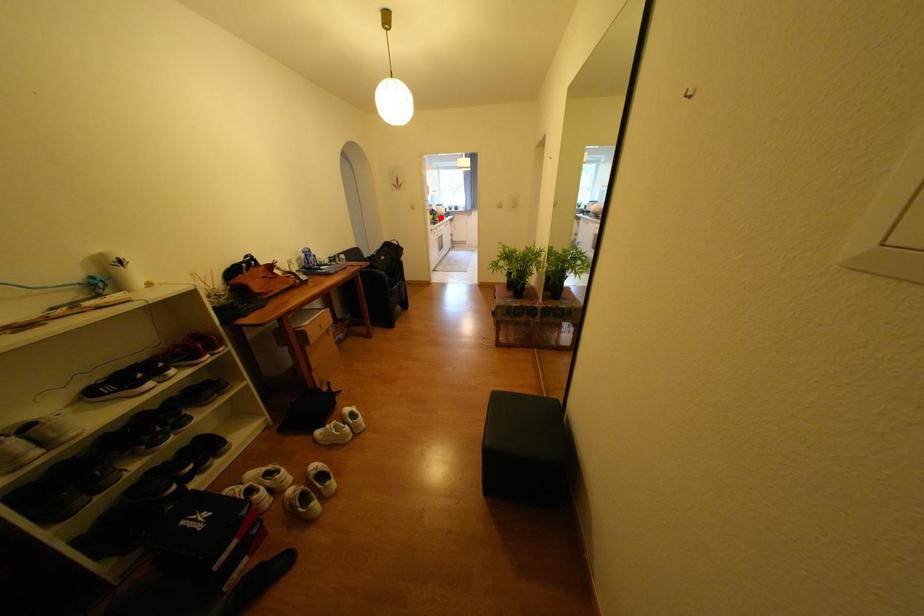
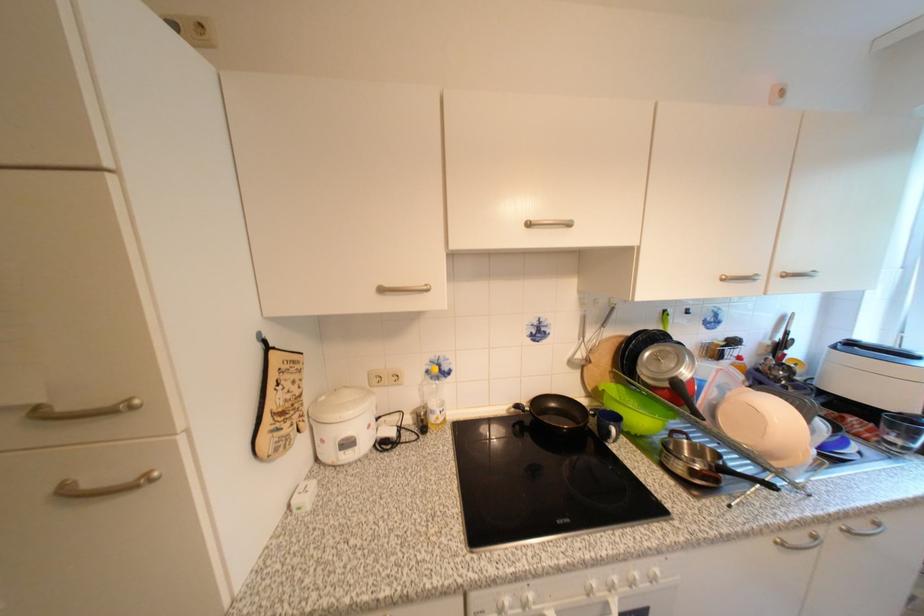
Question: I am providing you with two images of the same scene from different viewpoints. Given a red point in image1, look at the same physical point in image2. Is it:

Choices:
 (A) Closer to the viewpoint
 (B) Farther from the viewpoint

Answer: (B)